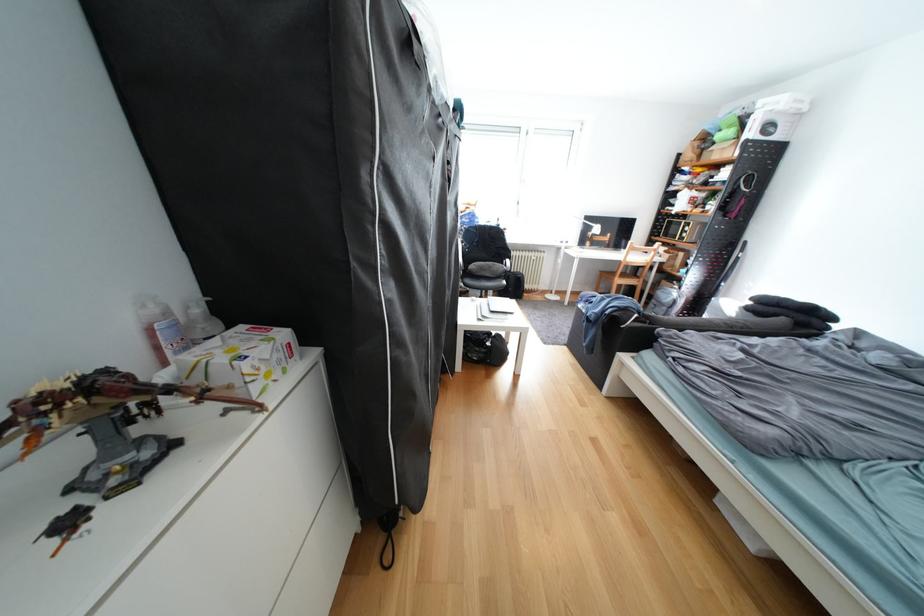
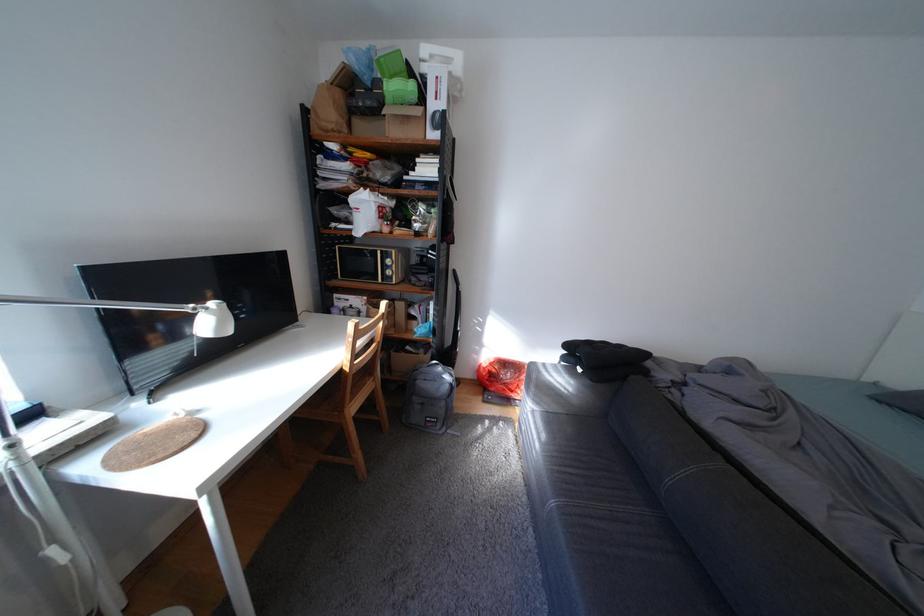
Where in the second image is the point corresponding to the point at 889,363 from the first image?

(773, 407)